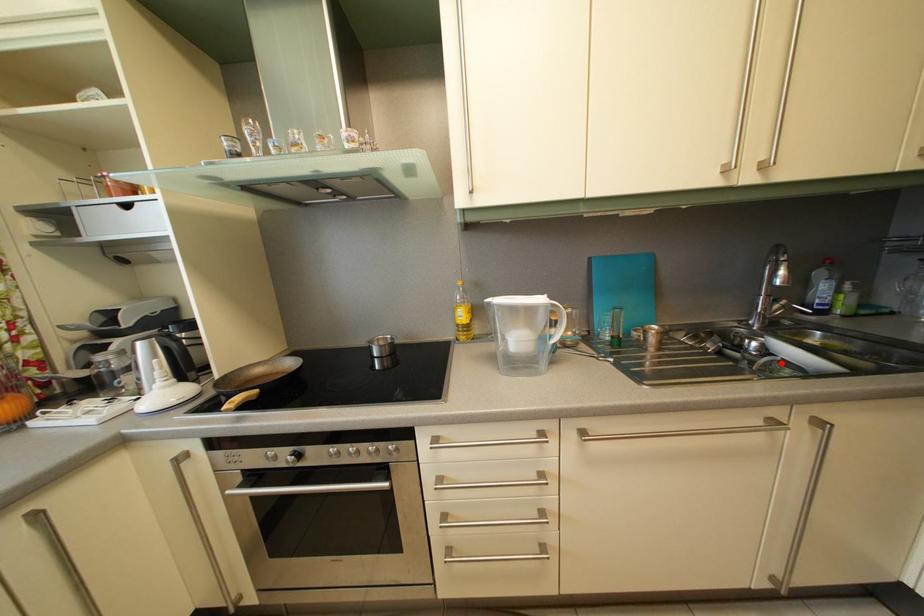
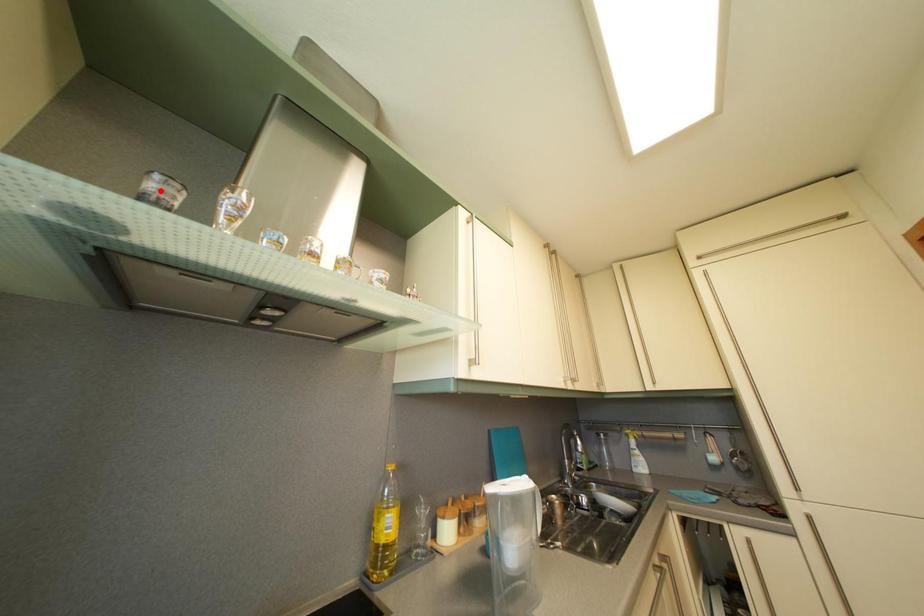
I am providing you with two images of the same scene from different viewpoints. A red point is marked on the first image and another point is marked on the second image. Is the marked point in image1 the same physical position as the marked point in image2?

No